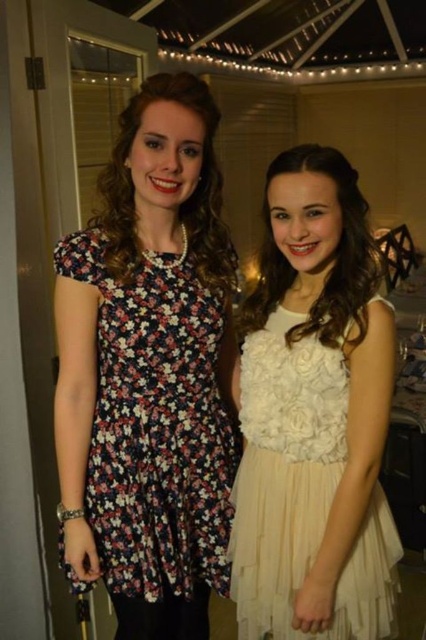
Question: Which point is farther from the camera taking this photo?

Choices:
 (A) (270, 634)
 (B) (229, 420)

Answer: (A)

Question: Can you confirm if floral print fabric dress at left is positioned below ivory tulle dress at center?

Choices:
 (A) no
 (B) yes

Answer: (A)

Question: Which object appears closest to the camera in this image?

Choices:
 (A) ivory tulle dress at center
 (B) floral print fabric dress at left

Answer: (A)

Question: Is floral print fabric dress at left to the right of ivory tulle dress at center from the viewer's perspective?

Choices:
 (A) no
 (B) yes

Answer: (A)

Question: Observing the image, what is the correct spatial positioning of floral print fabric dress at left in reference to ivory tulle dress at center?

Choices:
 (A) right
 (B) left

Answer: (B)

Question: Which point is closer to the camera taking this photo?

Choices:
 (A) (167, 554)
 (B) (322, 531)

Answer: (B)